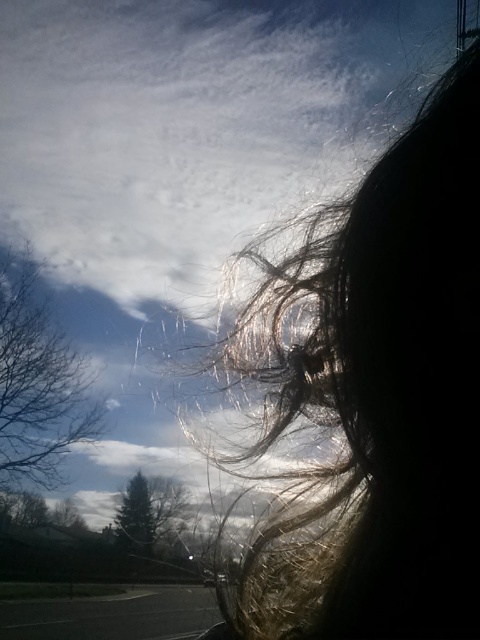
Question: In this image, where is silky brown hair at upper right located relative to green matte tree at lower left?

Choices:
 (A) left
 (B) right

Answer: (B)

Question: Is silky brown hair at upper right further to camera compared to bare branches at left?

Choices:
 (A) yes
 (B) no

Answer: (B)

Question: Which point is farther to the camera?

Choices:
 (A) bare branches at left
 (B) silky brown hair at upper right

Answer: (A)

Question: Considering the real-world distances, which object is closest to the bare branches at left?

Choices:
 (A) silky brown hair at upper right
 (B) green matte tree at lower left

Answer: (B)

Question: Does bare branches at left appear over green matte tree at lower left?

Choices:
 (A) no
 (B) yes

Answer: (B)

Question: Among these points, which one is farthest from the camera?

Choices:
 (A) (155, 534)
 (B) (230, 636)

Answer: (A)